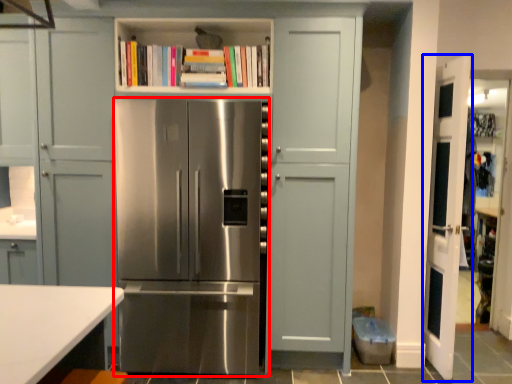
Question: Which object appears closest to the camera in this image, refrigerator (highlighted by a red box) or door (highlighted by a blue box)?

Choices:
 (A) refrigerator
 (B) door

Answer: (A)